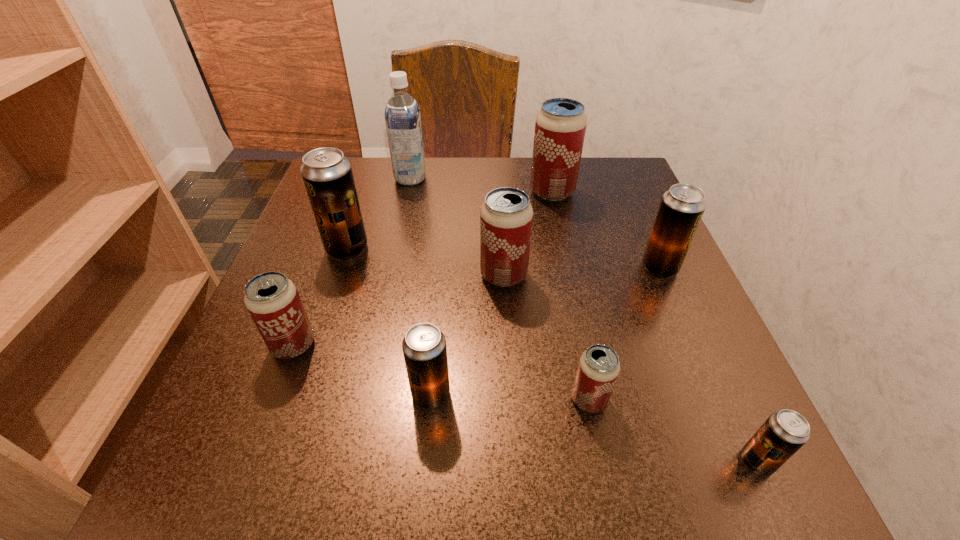
Image resolution: width=960 pixels, height=540 pixels. In order to click on the seventh object from right to left in this screenshot , I will do `click(402, 114)`.

This screenshot has height=540, width=960. I want to click on soya milk, so click(402, 114).

Where is `the biggest red beer can`? the biggest red beer can is located at coordinates (560, 126).

Where is `the farthest red beer can`? The height and width of the screenshot is (540, 960). the farthest red beer can is located at coordinates (560, 126).

Identify the location of the leftmost black beer can. (327, 174).

Find the location of a particular element. This screenshot has width=960, height=540. the second biggest black beer can is located at coordinates pos(682,206).

This screenshot has height=540, width=960. I want to click on the second farthest red beer can, so click(x=506, y=217).

This screenshot has width=960, height=540. What are the coordinates of `the second red beer can from left to right` in the screenshot? It's located at (506, 217).

Identify the location of the fourth object from left to right. The width and height of the screenshot is (960, 540). (424, 348).

Where is `the third beer can from left to right`? The width and height of the screenshot is (960, 540). the third beer can from left to right is located at coordinates (424, 348).